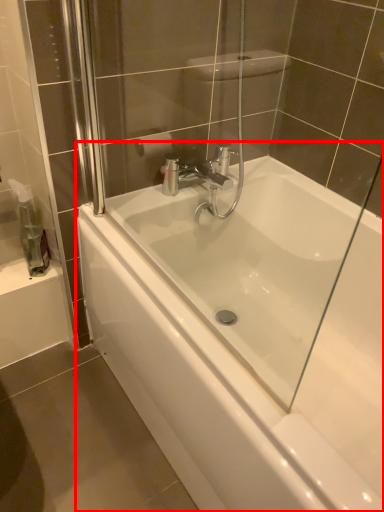
Question: In this image, where is bathtub (annotated by the red box) located relative to soap dispenser?

Choices:
 (A) left
 (B) right

Answer: (B)